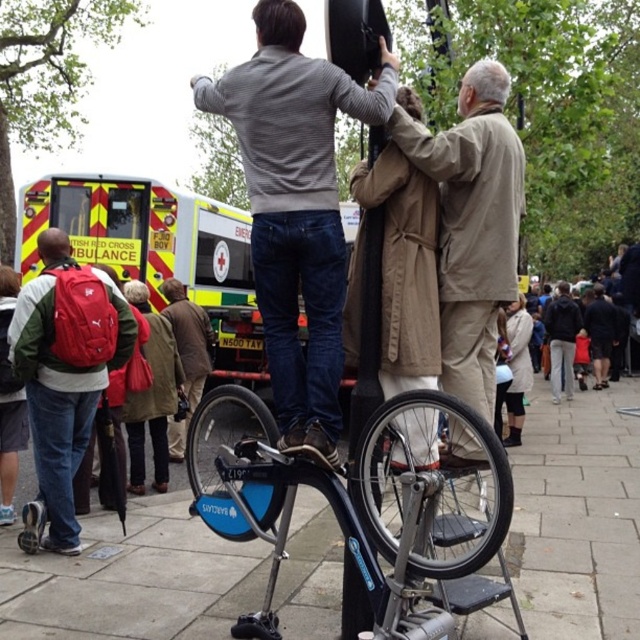
In the scene shown: You are a photographer at the event and need to capture a clear shot of both the matte gray sweater at center and the beige fabric coat at center. Based on their positions, which one is higher up in the frame?

The matte gray sweater at center is above the beige fabric coat at center, so it is higher up in the frame.

You are a photographer at the event and need to position a 1.2 meter wide backdrop between the matte gray sweater at center and the beige fabric coat at center. Can the backdrop fit between them without overlapping either?

The matte gray sweater at center is wider than the beige fabric coat at center. However, the exact distance between them isn

You are a photographer at the event and need to capture a clear shot of both the matte gray sweater at center and the blue metallic bicycle at center. Based on their positions, which object is higher in the frame?

The matte gray sweater at center is above the blue metallic bicycle at center, so it is higher in the frame.